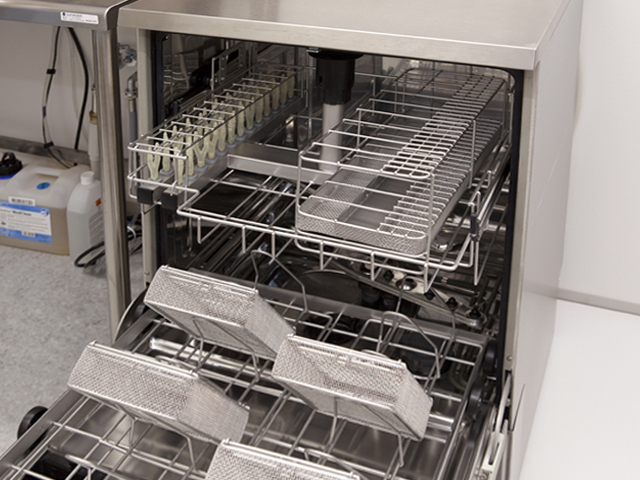
What are the coordinates of `floor` in the screenshot? It's located at (36, 314).